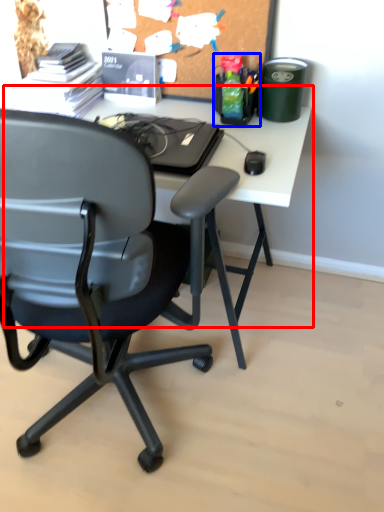
Question: Which of the following is the farthest to the observer, computer desk (highlighted by a red box) or stationery (highlighted by a blue box)?

Choices:
 (A) computer desk
 (B) stationery

Answer: (B)